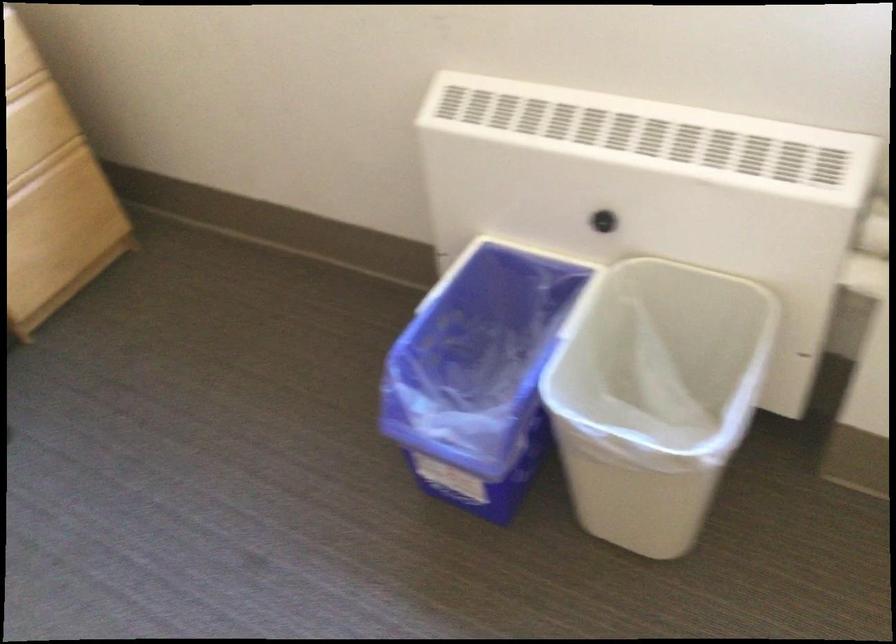
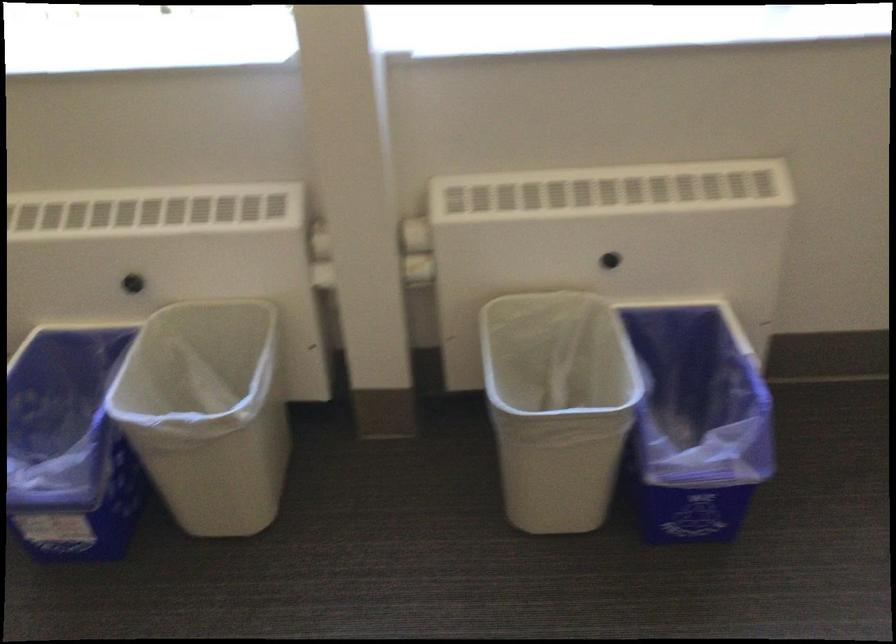
Find the pixel in the second image that matches the point at 488,382 in the first image.

(70, 447)